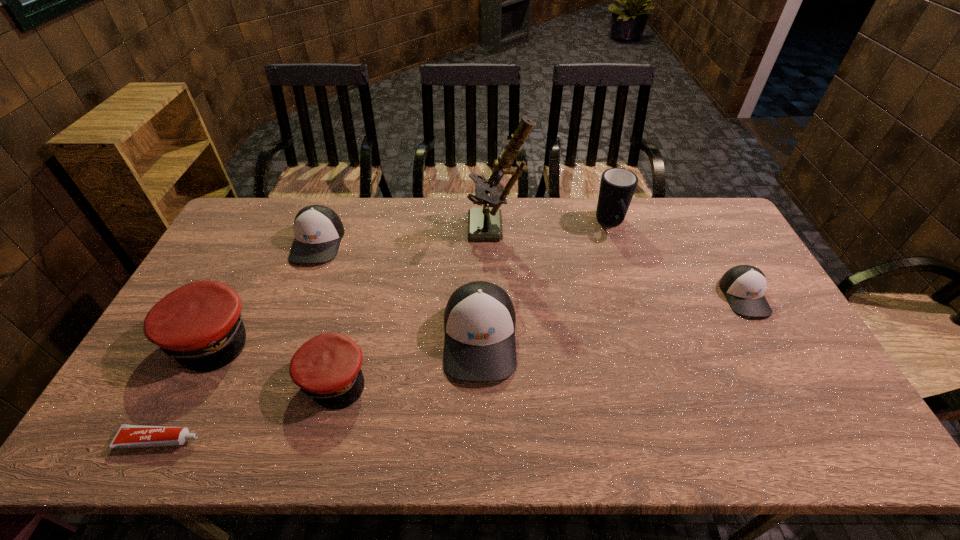
What are the coordinates of `vacant area that satisfies the following two spatial constraints: 1. at the eyepiece of the brown microscope; 2. on the front panel of the second cap from right to left` in the screenshot? It's located at (502, 338).

You are a GUI agent. You are given a task and a screenshot of the screen. Output one action in this format:
    pyautogui.click(x=<x>, y=<y>)
    Task: Click on the free location that satisfies the following two spatial constraints: 1. on the side of the second object from right to left with the handle; 2. at the front of the fifth object from right to left where the visor is located
    The width and height of the screenshot is (960, 540).
    Given the screenshot: What is the action you would take?
    pyautogui.click(x=661, y=378)

Identify the location of free space that satisfies the following two spatial constraints: 1. on the side of the seventh object from left to right with the handle; 2. at the front of the fourth object from left to right where the visor is located. The image size is (960, 540). (661, 378).

This screenshot has height=540, width=960. In order to click on free space that satisfies the following two spatial constraints: 1. on the front panel of the farthest gray cap; 2. at the nozzle of the nearest object in this screenshot , I will do `click(242, 440)`.

This screenshot has height=540, width=960. What are the coordinates of `vacant region that satisfies the following two spatial constraints: 1. on the front panel of the sixth shortest object; 2. at the nozzle of the nearest object` in the screenshot? It's located at (480, 440).

Identify the location of free space that satisfies the following two spatial constraints: 1. on the front panel of the second smallest gray cap; 2. at the nozzle of the nearest object. (242, 440).